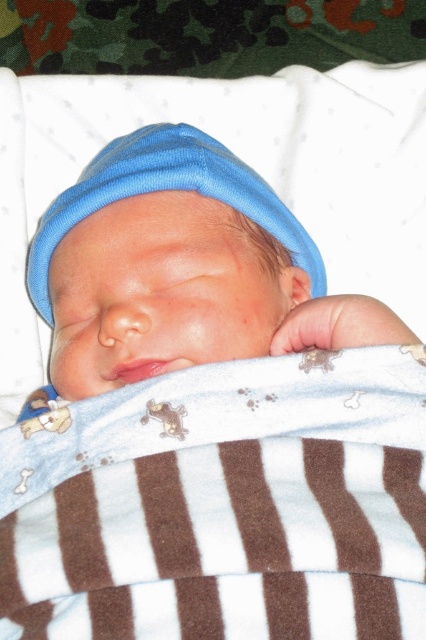
You are a photographer setting up a shoot for a baby product catalog. You need to position a light source to the left of the matte blue knit hat at center to highlight its texture. Will the light source also illuminate the brown striped fabric at center?

The brown striped fabric at center is positioned on the right side of matte blue knit hat at center. Since the light is placed to the left of the hat, the light will also illuminate the brown striped fabric at center as it is adjacent to the right side of the hat.

Based on the photo, you are a nurse preparing to dress a newborn. You have the brown striped fabric at center and the matte blue knit hat at center. Which item is wider?

The brown striped fabric at center is wider than the matte blue knit hat at center according to the description.